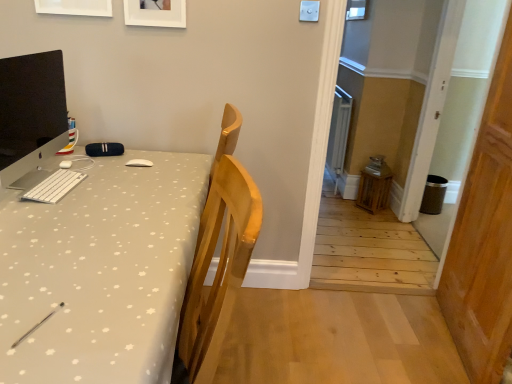
This screenshot has height=384, width=512. Identify the location of free space above white matte keyboard at left (from a real-world perspective). (53, 180).